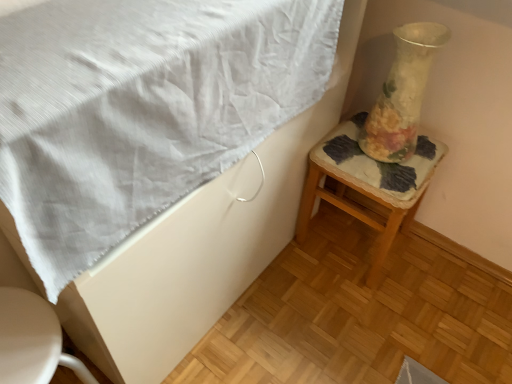
Find the location of a particular element. Image resolution: width=512 pixels, height=384 pixels. empty space that is ontop of white glossy toilet at lower left (from a real-world perspective) is located at coordinates (26, 338).